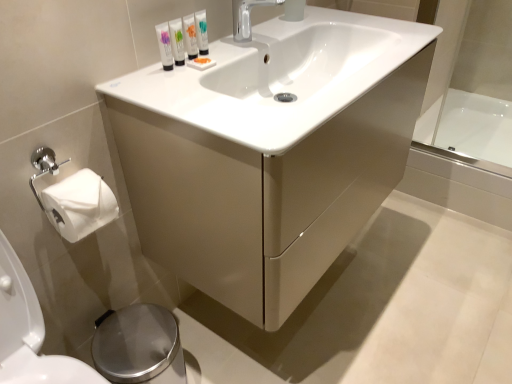
Question: Is white glossy tube at upper center, which is the 4th mouthwash in left-to-right order, wider than translucent plastic tubes at upper center, the second mouthwash from the left?

Choices:
 (A) yes
 (B) no

Answer: (B)

Question: Is white glossy tube at upper center, which is the first mouthwash in right-to-left order, to the left of translucent plastic tubes at upper center, the second mouthwash from the left, from the viewer's perspective?

Choices:
 (A) yes
 (B) no

Answer: (B)

Question: Can you confirm if white glossy tube at upper center, which is the 4th mouthwash in left-to-right order, is thinner than translucent plastic tubes at upper center, the second mouthwash from the left?

Choices:
 (A) yes
 (B) no

Answer: (A)

Question: Considering the relative positions of white glossy tube at upper center, which is the first mouthwash in right-to-left order, and translucent plastic tubes at upper center, positioned as the 3th mouthwash in right-to-left order, in the image provided, is white glossy tube at upper center, which is the first mouthwash in right-to-left order, to the right of translucent plastic tubes at upper center, positioned as the 3th mouthwash in right-to-left order, from the viewer's perspective?

Choices:
 (A) no
 (B) yes

Answer: (B)

Question: Is white glossy tube at upper center, which is the first mouthwash in right-to-left order, touching translucent plastic tubes at upper center, positioned as the 3th mouthwash in right-to-left order?

Choices:
 (A) no
 (B) yes

Answer: (B)

Question: Considering the positions of matte white tube at upper center, the second mouthwash when ordered from right to left, and polished stainless steel bidet at lower left in the image, is matte white tube at upper center, the second mouthwash when ordered from right to left, wider or thinner than polished stainless steel bidet at lower left?

Choices:
 (A) thin
 (B) wide

Answer: (A)

Question: From a real-world perspective, is matte white tube at upper center, marked as the 3th mouthwash in a left-to-right arrangement, physically located above or below polished stainless steel bidet at lower left?

Choices:
 (A) above
 (B) below

Answer: (A)

Question: Considering the relative positions of matte white tube at upper center, marked as the 3th mouthwash in a left-to-right arrangement, and polished stainless steel bidet at lower left in the image provided, is matte white tube at upper center, marked as the 3th mouthwash in a left-to-right arrangement, to the left or to the right of polished stainless steel bidet at lower left?

Choices:
 (A) right
 (B) left

Answer: (A)

Question: Does point (194, 29) appear closer or farther from the camera than point (143, 347)?

Choices:
 (A) farther
 (B) closer

Answer: (B)

Question: From a real-world perspective, is white glossy bathtub at right positioned above or below polished stainless steel bidet at lower left?

Choices:
 (A) above
 (B) below

Answer: (A)

Question: From the image's perspective, is white glossy bathtub at right above or below polished stainless steel bidet at lower left?

Choices:
 (A) below
 (B) above

Answer: (B)

Question: Considering the positions of white glossy bathtub at right and polished stainless steel bidet at lower left in the image, is white glossy bathtub at right wider or thinner than polished stainless steel bidet at lower left?

Choices:
 (A) wide
 (B) thin

Answer: (A)

Question: Do you think white glossy bathtub at right is within polished stainless steel bidet at lower left, or outside of it?

Choices:
 (A) outside
 (B) inside

Answer: (A)

Question: Is matte white tube at upper center, marked as the 3th mouthwash in a left-to-right arrangement, inside or outside of white glossy tube at upper center, which is the first mouthwash in right-to-left order?

Choices:
 (A) inside
 (B) outside

Answer: (B)

Question: Is point (197, 49) positioned closer to the camera than point (196, 18)?

Choices:
 (A) farther
 (B) closer

Answer: (A)